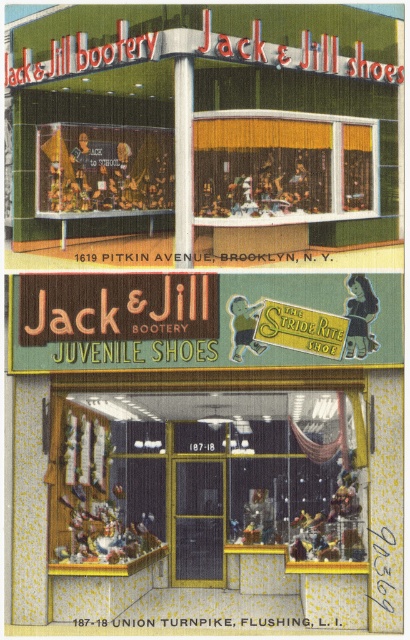
You are a customer looking at the Brooklyn location storefront. You see a wooden display case at center and a green fabric signboard at center. Which object is positioned to the right of the other?

The wooden display case at center is to the right of the green fabric signboard at center.

You are a customer standing in front of the Brooklyn location of Jack and Jill Bootery. You see a wooden display case at center and a green fabric signboard at center. Which object is closer to you?

The wooden display case at center is closer to you because the green fabric signboard at center is behind it.

You are standing in front of the Brooklyn location of Jack and Jill Bootery. You want to place a new pair of shoes in the wooden display case at center. Where exactly should you place them?

The wooden display case at center is located at point (205,481), so place the shoes there.